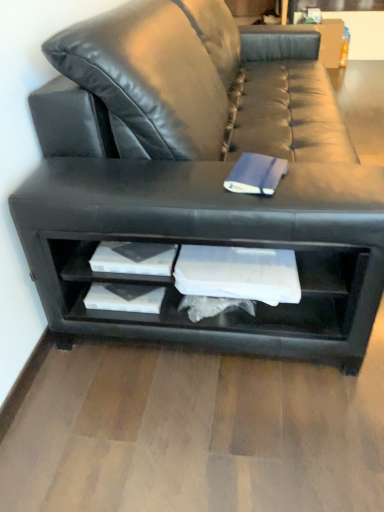
Question: Is blue matte paper at center facing away from black leather shelf at lower center?

Choices:
 (A) yes
 (B) no

Answer: (B)

Question: From a real-world perspective, is blue matte paper at center physically above black leather shelf at lower center?

Choices:
 (A) yes
 (B) no

Answer: (A)

Question: Is blue matte paper at center bigger than black leather shelf at lower center?

Choices:
 (A) no
 (B) yes

Answer: (A)

Question: Considering the relative sizes of blue matte paper at center and black leather shelf at lower center in the image provided, is blue matte paper at center smaller than black leather shelf at lower center?

Choices:
 (A) no
 (B) yes

Answer: (B)

Question: Is blue matte paper at center next to black leather shelf at lower center and touching it?

Choices:
 (A) no
 (B) yes

Answer: (A)

Question: Is black leather couch at center spatially inside black leather shelf at lower center, or outside of it?

Choices:
 (A) inside
 (B) outside

Answer: (B)

Question: Considering the positions of point (69, 212) and point (296, 258), is point (69, 212) closer or farther from the camera than point (296, 258)?

Choices:
 (A) farther
 (B) closer

Answer: (B)

Question: From a real-world perspective, relative to black leather shelf at lower center, is black leather couch at center vertically above or below?

Choices:
 (A) above
 (B) below

Answer: (A)

Question: In terms of height, does black leather couch at center look taller or shorter compared to black leather shelf at lower center?

Choices:
 (A) short
 (B) tall

Answer: (B)

Question: Is blue matte paper at center spatially inside black leather couch at center, or outside of it?

Choices:
 (A) outside
 (B) inside

Answer: (B)

Question: Does point (248, 156) appear closer or farther from the camera than point (165, 54)?

Choices:
 (A) farther
 (B) closer

Answer: (B)

Question: Visually, is blue matte paper at center positioned to the left or to the right of black leather couch at center?

Choices:
 (A) right
 (B) left

Answer: (B)

Question: Is blue matte paper at center in front of or behind black leather couch at center in the image?

Choices:
 (A) behind
 (B) front

Answer: (A)

Question: Considering the positions of black leather couch at center and blue matte paper at center in the image, is black leather couch at center taller or shorter than blue matte paper at center?

Choices:
 (A) short
 (B) tall

Answer: (B)

Question: Considering the positions of black leather couch at center and blue matte paper at center in the image, is black leather couch at center wider or thinner than blue matte paper at center?

Choices:
 (A) thin
 (B) wide

Answer: (B)